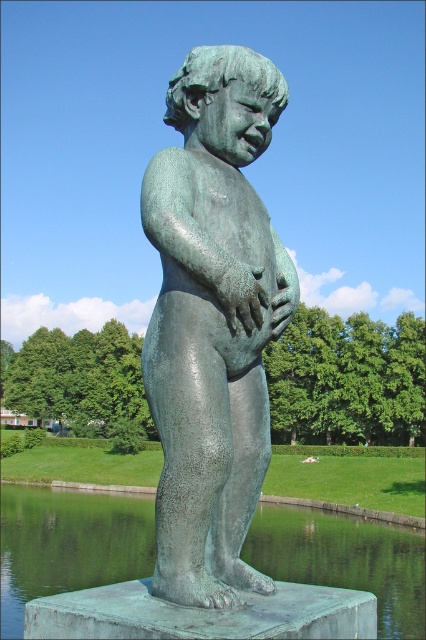
Question: Among these points, which one is farthest from the camera?

Choices:
 (A) (227, 582)
 (B) (314, 524)

Answer: (B)

Question: Is green patina statue at center below greenish-brown water at lower center?

Choices:
 (A) no
 (B) yes

Answer: (A)

Question: Observing the image, what is the correct spatial positioning of green patina statue at center in reference to greenish-brown water at lower center?

Choices:
 (A) below
 (B) above

Answer: (B)

Question: Which object is farther from the camera taking this photo?

Choices:
 (A) greenish-brown water at lower center
 (B) green patina statue at center

Answer: (A)

Question: Can you confirm if green patina statue at center is bigger than greenish-brown water at lower center?

Choices:
 (A) no
 (B) yes

Answer: (A)

Question: Which of the following is the closest to the observer?

Choices:
 (A) green patina statue at center
 (B) greenish-brown water at lower center

Answer: (A)